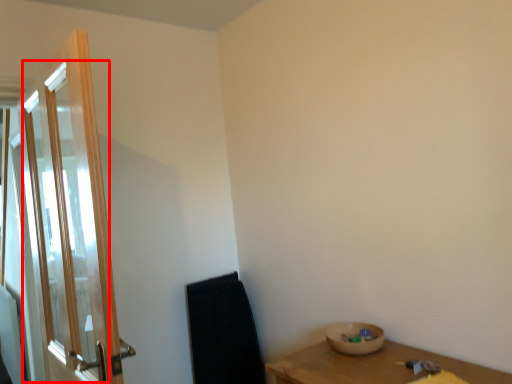
Question: From the image, what is the correct spatial relationship of screen door (annotated by the red box) in relation to basin?

Choices:
 (A) left
 (B) right

Answer: (A)